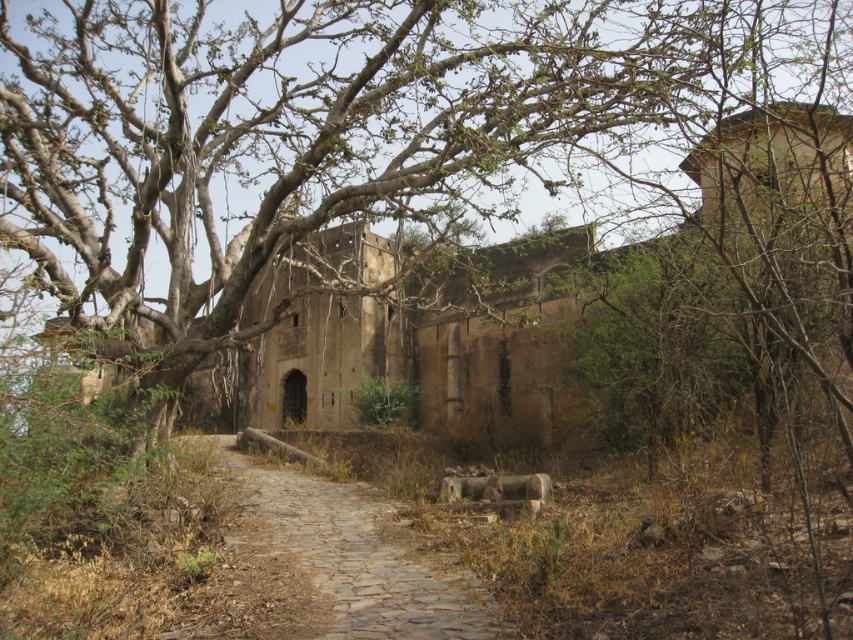
Question: Which point is closer to the camera taking this photo?

Choices:
 (A) (480, 490)
 (B) (264, 476)

Answer: (A)

Question: Does brown stone path at center have a lesser width compared to rusty metallic barrel at center?

Choices:
 (A) no
 (B) yes

Answer: (A)

Question: In this image, where is brown stone path at center located relative to rusty metallic barrel at center?

Choices:
 (A) right
 (B) left

Answer: (B)

Question: Which object is farther from the camera taking this photo?

Choices:
 (A) brown stone path at center
 (B) rusty metallic barrel at center

Answer: (B)

Question: Is brown stone path at center below rusty metallic barrel at center?

Choices:
 (A) no
 (B) yes

Answer: (B)